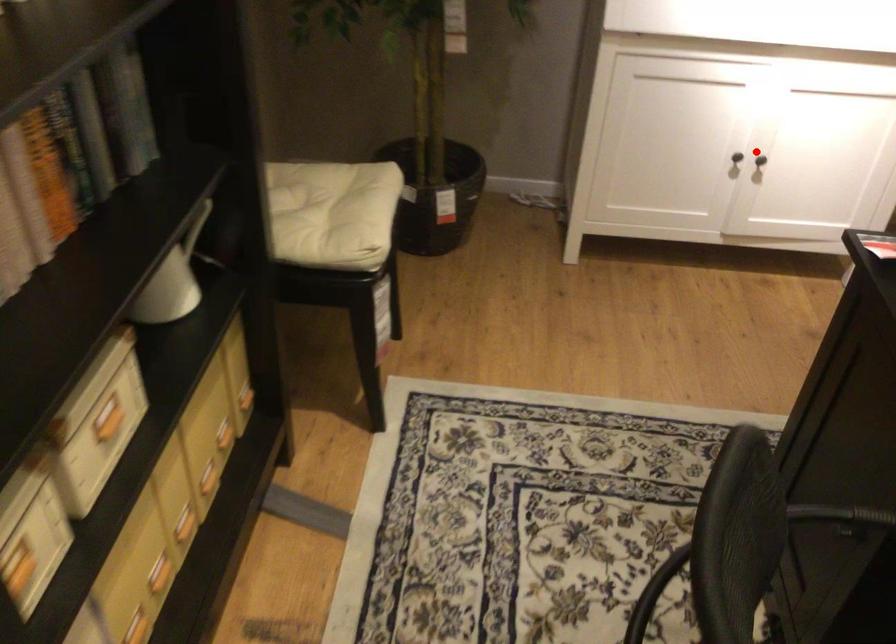
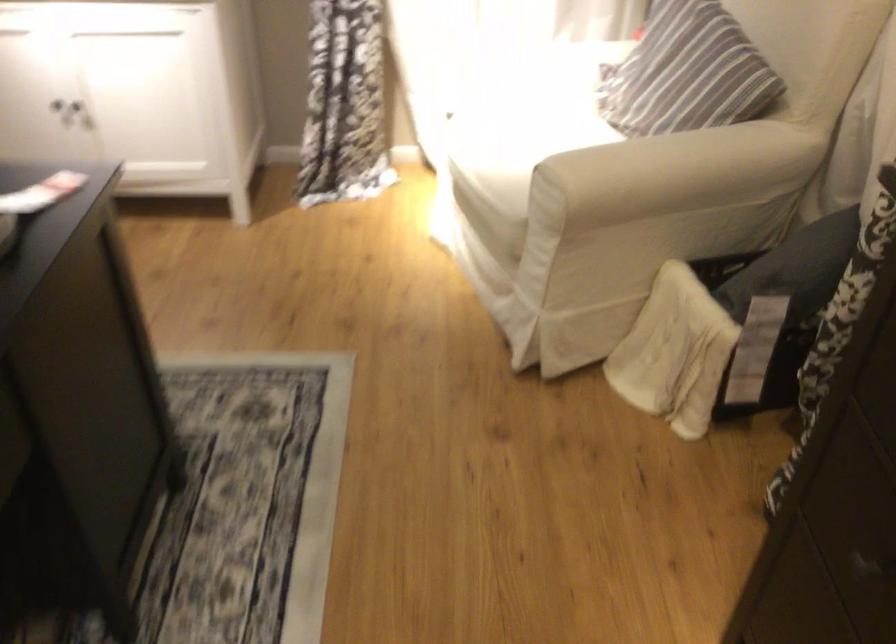
In the second image, find the point that corresponds to the highlighted location in the first image.

(67, 108)